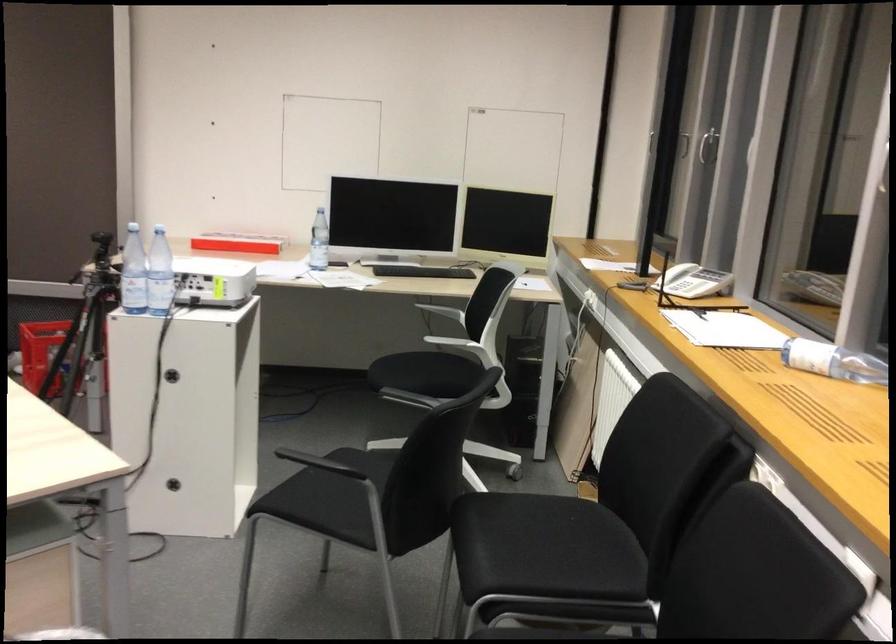
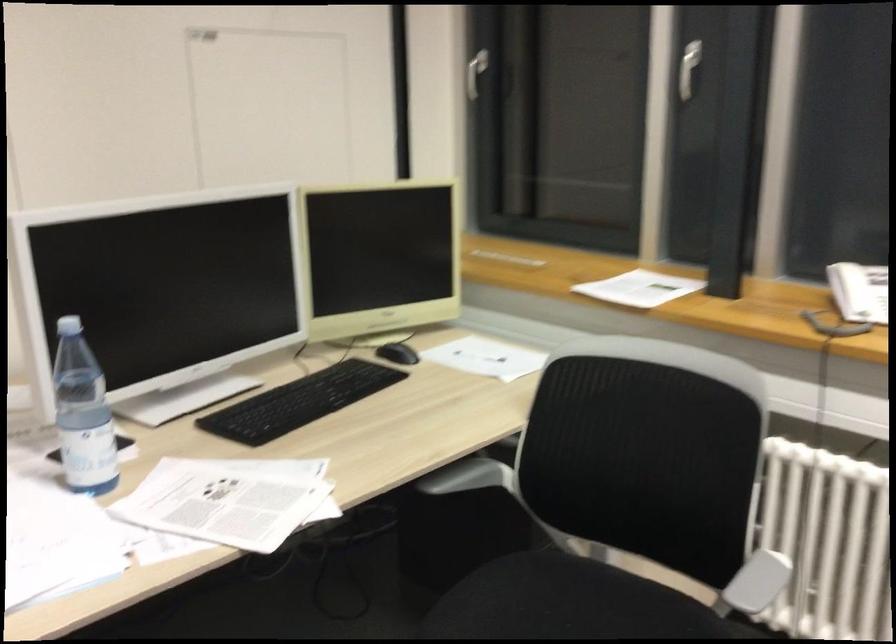
Where in the second image is the point corresponding to (x=444, y=339) from the first image?

(757, 582)